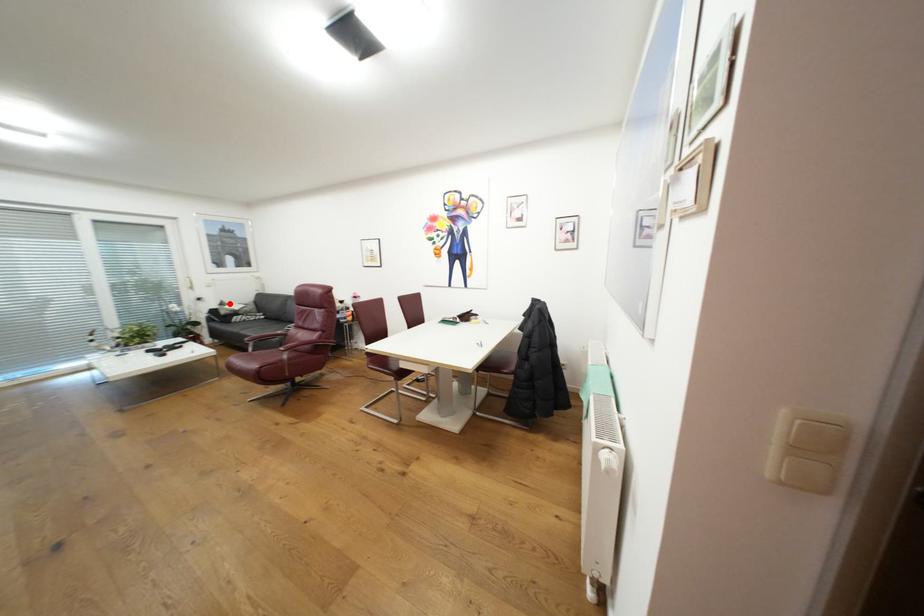
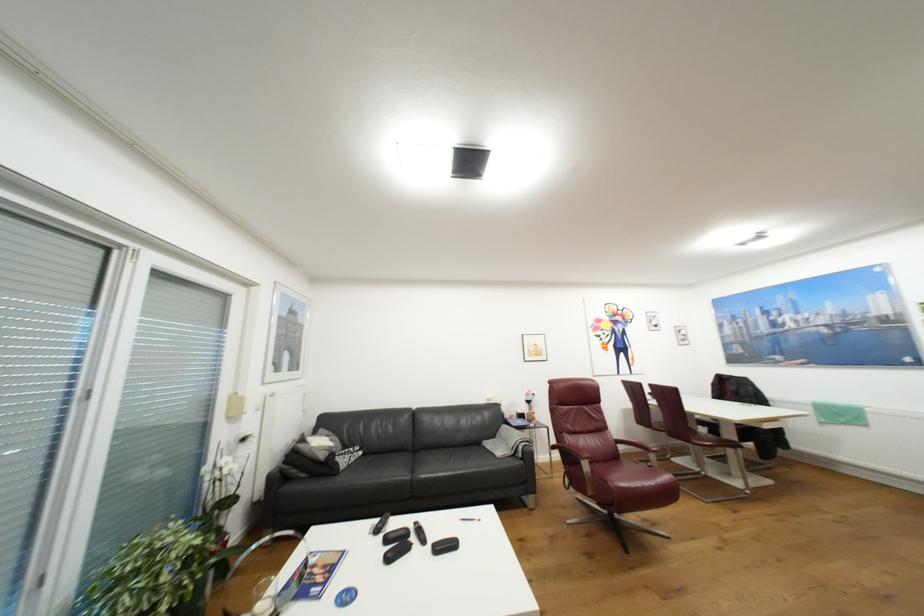
The point at the highlighted location is marked in the first image. Where is the corresponding point in the second image?

(309, 440)